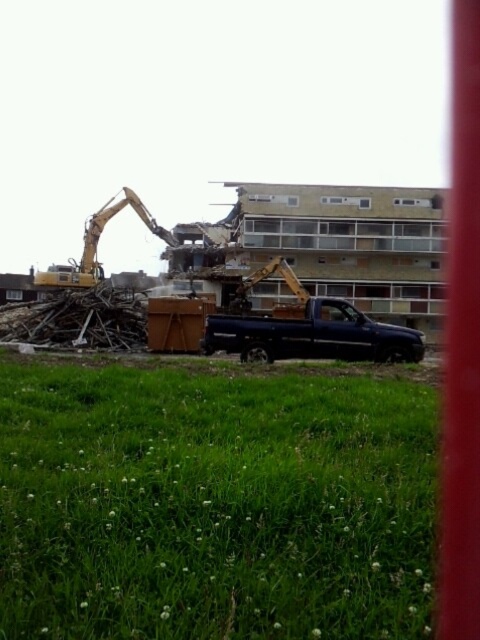
Question: Which point is farther to the camera?

Choices:
 (A) (49, 284)
 (B) (136, 481)

Answer: (A)

Question: Is matte black truck at center wider than yellow metallic excavator at left?

Choices:
 (A) yes
 (B) no

Answer: (B)

Question: Where is green grassy field at lower center located in relation to yellow metallic excavator at left in the image?

Choices:
 (A) above
 (B) below

Answer: (B)

Question: Which point is closer to the camera?

Choices:
 (A) (305, 486)
 (B) (94, 253)

Answer: (A)

Question: Which point appears farthest from the camera in this image?

Choices:
 (A) (117, 624)
 (B) (60, 284)

Answer: (B)

Question: Can you confirm if green grassy field at lower center is positioned to the right of matte black truck at center?

Choices:
 (A) no
 (B) yes

Answer: (B)